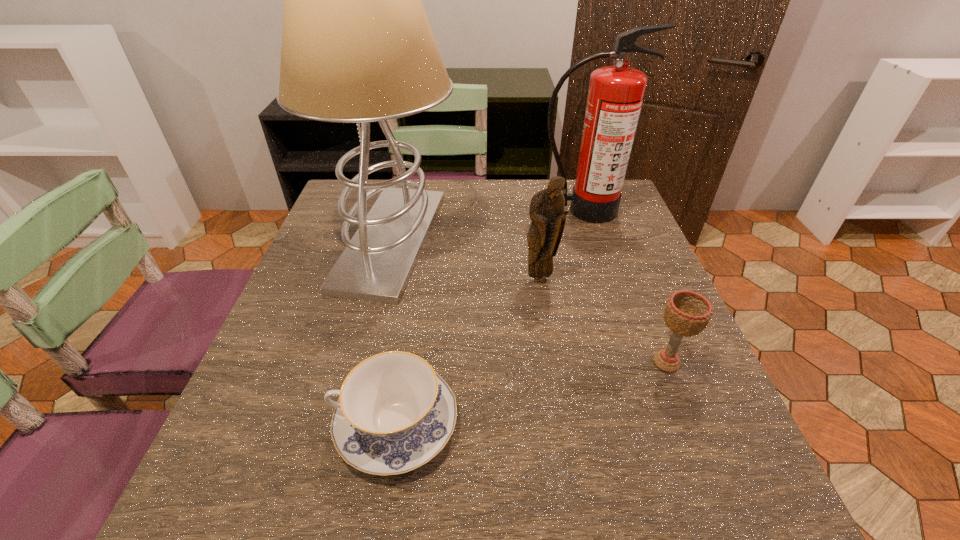
This screenshot has height=540, width=960. In the image, there is a desktop. What are the coordinates of `vacant space at the far edge` in the screenshot? It's located at (461, 187).

In the image, there is a desktop. Where is `vacant space at the near edge`? The width and height of the screenshot is (960, 540). vacant space at the near edge is located at coordinates (364, 508).

In the image, there is a desktop. Identify the location of vacant region at the left edge. The width and height of the screenshot is (960, 540). coord(286,395).

In the image, there is a desktop. Find the location of `free space at the right edge`. free space at the right edge is located at coordinates (616, 239).

The width and height of the screenshot is (960, 540). I want to click on free location at the far left corner of the desktop, so click(333, 216).

Where is `vacant region at the near left corner of the desktop`? The height and width of the screenshot is (540, 960). vacant region at the near left corner of the desktop is located at coordinates (198, 529).

Find the location of `vacant space at the near right corner of the desktop`. vacant space at the near right corner of the desktop is located at coordinates (774, 509).

This screenshot has height=540, width=960. Find the location of `free space between the table lamp and the chinaware`. free space between the table lamp and the chinaware is located at coordinates (394, 332).

I want to click on vacant point located between the shortest object and the second tallest object, so click(x=490, y=317).

Locate an element on the screen. The height and width of the screenshot is (540, 960). free area in between the third shortest object and the shortest object is located at coordinates (468, 352).